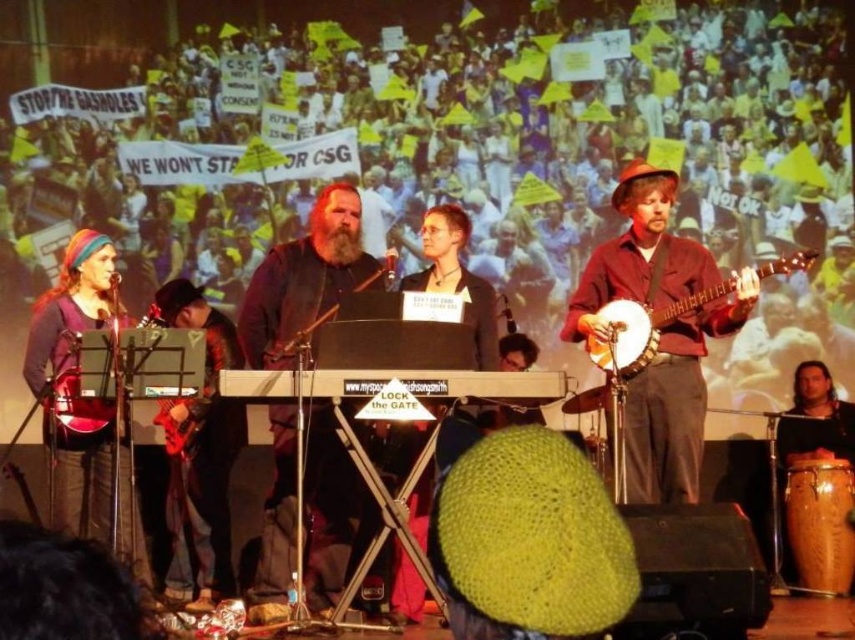
Is brown leather hat at upper right wider than metallic red drum at left?

Indeed, brown leather hat at upper right has a greater width compared to metallic red drum at left.

Is point (647, 477) behind point (86, 356)?

Yes, it is.

Image resolution: width=855 pixels, height=640 pixels. Find the location of `brown leather hat at upper right`. brown leather hat at upper right is located at coordinates (677, 400).

Can you confirm if bearded man at center is shorter than wooden banjo at right?

No.

Between point (348, 520) and point (646, 314), which one is positioned in front?

Point (348, 520) is in front.

Identify the location of bearded man at center. (305, 280).

Which is more to the right, multicolored fabric headband at left or shiny black guitar at lower left?

From the viewer's perspective, shiny black guitar at lower left appears more on the right side.

Between point (102, 308) and point (192, 596), which one is positioned behind?

Positioned behind is point (192, 596).

This screenshot has height=640, width=855. What are the coordinates of `multicolored fabric headband at left` in the screenshot? It's located at (107, 412).